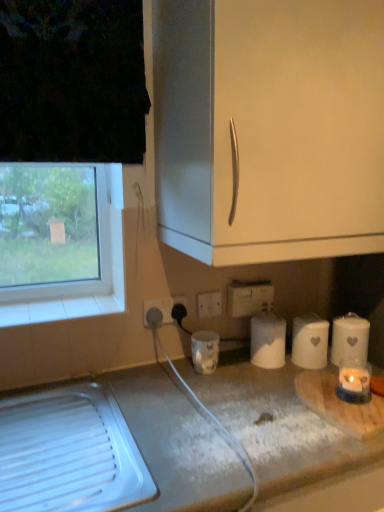
You are a GUI agent. You are given a task and a screenshot of the screen. Output one action in this format:
    pyautogui.click(x=<x>, y=<y>)
    Task: Click on the unoccupied region to the right of white ceramic candle at lower center
    
    Given the screenshot: What is the action you would take?
    pyautogui.click(x=249, y=375)